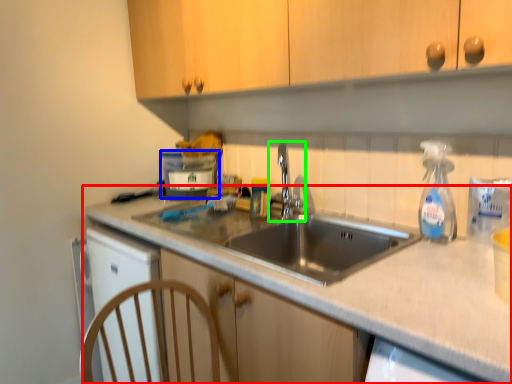
Question: Which is farther away from countertop (highlighted by a red box)? appliance (highlighted by a blue box) or tap (highlighted by a green box)?

Choices:
 (A) appliance
 (B) tap

Answer: (A)